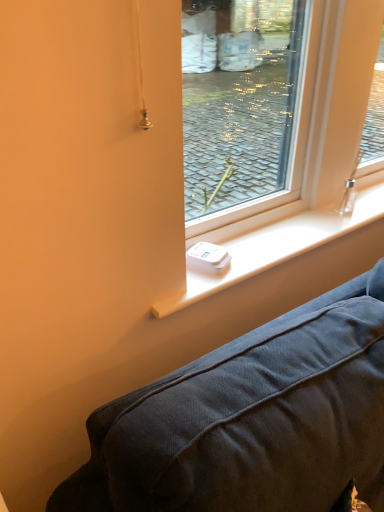
Question: Is transparent glass window at center at the right side of white plastic device at center?

Choices:
 (A) yes
 (B) no

Answer: (A)

Question: Is transparent glass window at center aimed at white plastic device at center?

Choices:
 (A) yes
 (B) no

Answer: (A)

Question: From a real-world perspective, is transparent glass window at center beneath white plastic device at center?

Choices:
 (A) yes
 (B) no

Answer: (B)

Question: Is transparent glass window at center closer to camera compared to white plastic device at center?

Choices:
 (A) no
 (B) yes

Answer: (B)

Question: From a real-world perspective, is transparent glass window at center on white plastic device at center?

Choices:
 (A) no
 (B) yes

Answer: (B)

Question: Is transparent glass window at center surrounding white plastic device at center?

Choices:
 (A) no
 (B) yes

Answer: (A)

Question: Is white plastic device at center further to the viewer compared to transparent glass window at center?

Choices:
 (A) yes
 (B) no

Answer: (A)

Question: Is transparent glass window at center inside white plastic device at center?

Choices:
 (A) yes
 (B) no

Answer: (B)

Question: Can you confirm if white plastic device at center is thinner than transparent glass window at center?

Choices:
 (A) yes
 (B) no

Answer: (B)

Question: Does white plastic device at center lie in front of transparent glass window at center?

Choices:
 (A) no
 (B) yes

Answer: (A)

Question: From the image's perspective, is white plastic device at center on transparent glass window at center?

Choices:
 (A) no
 (B) yes

Answer: (A)

Question: Is white plastic device at center aimed at transparent glass window at center?

Choices:
 (A) no
 (B) yes

Answer: (A)

Question: From a real-world perspective, is white plastic device at center physically located above or below transparent glass window at center?

Choices:
 (A) below
 (B) above

Answer: (A)